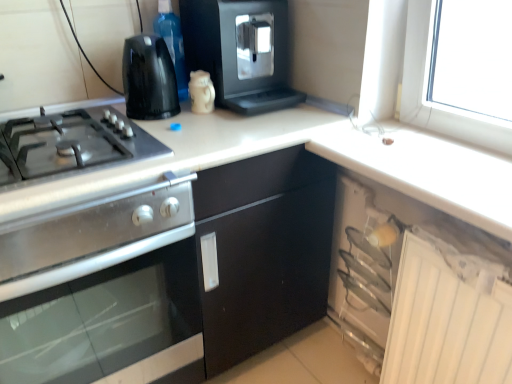
Question: Considering the relative sizes of black plastic kettle at upper left, which is the third kitchen appliance in bottom-to-top order, and white plastic cabinet at lower right in the image provided, is black plastic kettle at upper left, which is the third kitchen appliance in bottom-to-top order, smaller than white plastic cabinet at lower right?

Choices:
 (A) no
 (B) yes

Answer: (B)

Question: From the image's perspective, is black plastic kettle at upper left, which is the third kitchen appliance in bottom-to-top order, beneath white plastic cabinet at lower right?

Choices:
 (A) no
 (B) yes

Answer: (A)

Question: Is black plastic kettle at upper left, arranged as the 2th kitchen appliance when viewed from the top, with white plastic cabinet at lower right?

Choices:
 (A) no
 (B) yes

Answer: (A)

Question: Can you confirm if black plastic kettle at upper left, which is the third kitchen appliance in bottom-to-top order, is positioned to the left of white plastic cabinet at lower right?

Choices:
 (A) no
 (B) yes

Answer: (B)

Question: Is black plastic kettle at upper left, arranged as the 2th kitchen appliance when viewed from the top, closer to the viewer compared to white plastic cabinet at lower right?

Choices:
 (A) no
 (B) yes

Answer: (A)

Question: Relative to black plastic coffee machine at upper center, positioned as the 4th kitchen appliance in bottom-to-top order, is white plastic cabinet at lower right in front or behind?

Choices:
 (A) front
 (B) behind

Answer: (A)

Question: Is white plastic cabinet at lower right taller or shorter than black plastic coffee machine at upper center, positioned as the 4th kitchen appliance in bottom-to-top order?

Choices:
 (A) tall
 (B) short

Answer: (A)

Question: Looking at their shapes, would you say white plastic cabinet at lower right is wider or thinner than black plastic coffee machine at upper center, which ranks as the first kitchen appliance in top-to-bottom order?

Choices:
 (A) thin
 (B) wide

Answer: (A)

Question: From the image's perspective, is white plastic cabinet at lower right above or below black plastic coffee machine at upper center, positioned as the 4th kitchen appliance in bottom-to-top order?

Choices:
 (A) above
 (B) below

Answer: (B)

Question: Would you say white glossy mug at upper center, the third kitchen appliance when ordered from top to bottom, is to the left or to the right of white glossy counter top at upper right in the picture?

Choices:
 (A) right
 (B) left

Answer: (B)

Question: Choose the correct answer: Is white glossy mug at upper center, which ranks as the 2th kitchen appliance in bottom-to-top order, inside white glossy counter top at upper right or outside it?

Choices:
 (A) inside
 (B) outside

Answer: (B)

Question: In the image, is white glossy mug at upper center, which ranks as the 2th kitchen appliance in bottom-to-top order, positioned in front of or behind white glossy counter top at upper right?

Choices:
 (A) front
 (B) behind

Answer: (B)

Question: Looking at the image, does white glossy mug at upper center, which ranks as the 2th kitchen appliance in bottom-to-top order, seem bigger or smaller compared to white glossy counter top at upper right?

Choices:
 (A) big
 (B) small

Answer: (B)

Question: In the image, is white plastic cabinet at lower right on the left side or the right side of white glossy mug at upper center, the third kitchen appliance when ordered from top to bottom?

Choices:
 (A) right
 (B) left

Answer: (A)

Question: Considering the positions of white plastic cabinet at lower right and white glossy mug at upper center, the third kitchen appliance when ordered from top to bottom, in the image, is white plastic cabinet at lower right wider or thinner than white glossy mug at upper center, the third kitchen appliance when ordered from top to bottom,?

Choices:
 (A) wide
 (B) thin

Answer: (A)